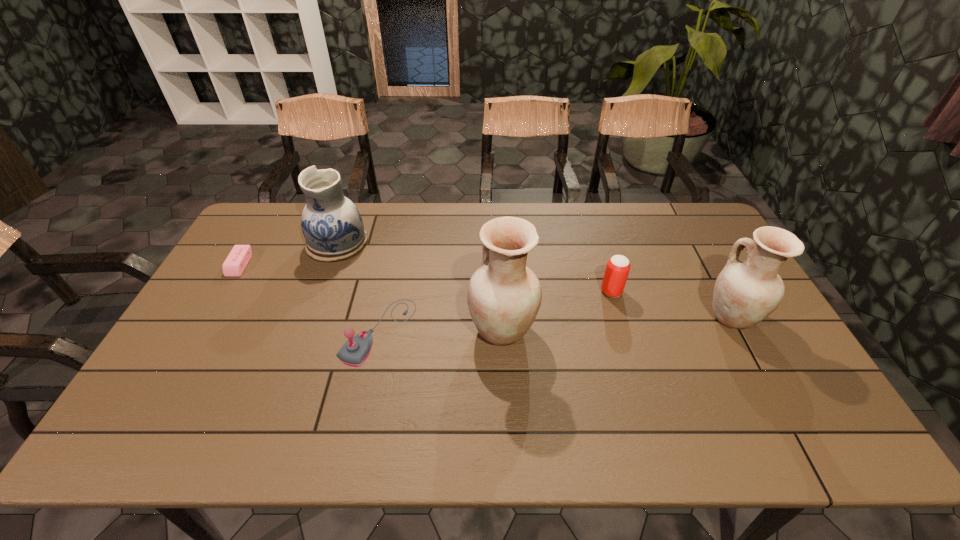
Locate an element on the screen. free region at the far edge of the desktop is located at coordinates (530, 207).

In the image, there is a desktop. At what (x,y) coordinates should I click in order to perform the action: click on vacant space at the left edge. Please return your answer as a coordinate pair (x, y). Looking at the image, I should click on (210, 327).

Find the location of a particular element. This screenshot has width=960, height=540. vacant space at the right edge of the desktop is located at coordinates click(712, 251).

This screenshot has width=960, height=540. I want to click on vacant space at the far left corner of the desktop, so click(x=305, y=202).

You are a GUI agent. You are given a task and a screenshot of the screen. Output one action in this format:
    pyautogui.click(x=<x>, y=<y>)
    Task: Click on the blank area at the near left corner
    This screenshot has width=960, height=540.
    Given the screenshot: What is the action you would take?
    pyautogui.click(x=195, y=401)

In the image, there is a desktop. Where is `vacant space at the near right corner`? Image resolution: width=960 pixels, height=540 pixels. vacant space at the near right corner is located at coordinates (755, 401).

Where is `free spot between the leftmost object and the third object from left to right`? This screenshot has width=960, height=540. free spot between the leftmost object and the third object from left to right is located at coordinates (309, 298).

Identify the location of blank region between the second pottery from left to right and the beer can. (557, 310).

This screenshot has width=960, height=540. In order to click on free space that is in between the tallest object and the second object from left to right in this screenshot , I will do `click(420, 286)`.

Where is `vacant area that lies between the rightmost pottery and the second shortest object`? The height and width of the screenshot is (540, 960). vacant area that lies between the rightmost pottery and the second shortest object is located at coordinates (555, 324).